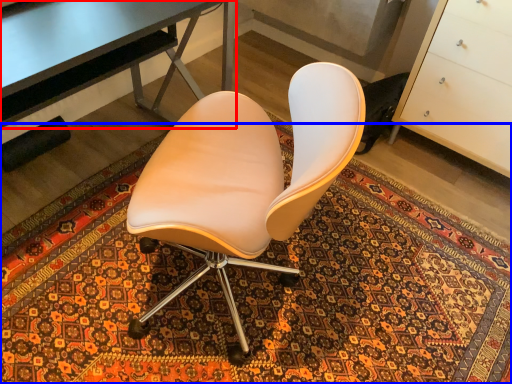
Question: Among these objects, which one is nearest to the camera, desk (highlighted by a red box) or mat (highlighted by a blue box)?

Choices:
 (A) desk
 (B) mat

Answer: (B)